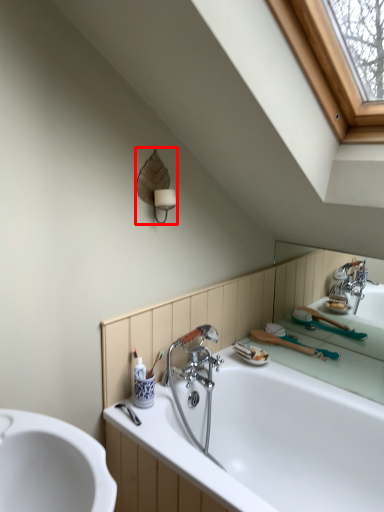
Question: From the image's perspective, where is fixture (annotated by the red box) located in relation to bathtub in the image?

Choices:
 (A) below
 (B) above

Answer: (B)